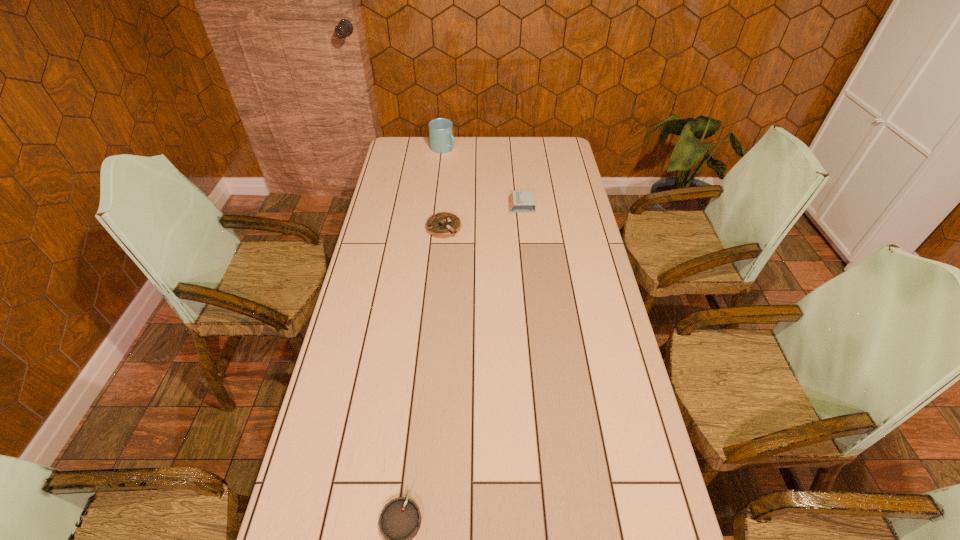
The width and height of the screenshot is (960, 540). In order to click on the farthest object in this screenshot , I will do `click(442, 141)`.

Where is `mug`? The width and height of the screenshot is (960, 540). mug is located at coordinates (442, 141).

This screenshot has height=540, width=960. In order to click on the second nearest object in this screenshot , I will do `click(442, 225)`.

This screenshot has width=960, height=540. Find the location of `the farther ashtray`. the farther ashtray is located at coordinates (442, 225).

You are a GUI agent. You are given a task and a screenshot of the screen. Output one action in this format:
    pyautogui.click(x=<x>, y=<y>)
    Task: Click on the third nearest object
    
    Given the screenshot: What is the action you would take?
    pyautogui.click(x=519, y=201)

Locate an element on the screen. The image size is (960, 540). alarm clock is located at coordinates (519, 201).

The height and width of the screenshot is (540, 960). In order to click on free spot located on the front of the mug in this screenshot , I will do `click(441, 169)`.

Find the location of a particular element. This screenshot has height=540, width=960. vacant region located 0.230m on the right of the farther ashtray is located at coordinates (519, 227).

Locate an element on the screen. The height and width of the screenshot is (540, 960). vacant space located 0.190m on the right of the rightmost object is located at coordinates (579, 205).

This screenshot has width=960, height=540. Identify the location of object that is at the far edge. (442, 141).